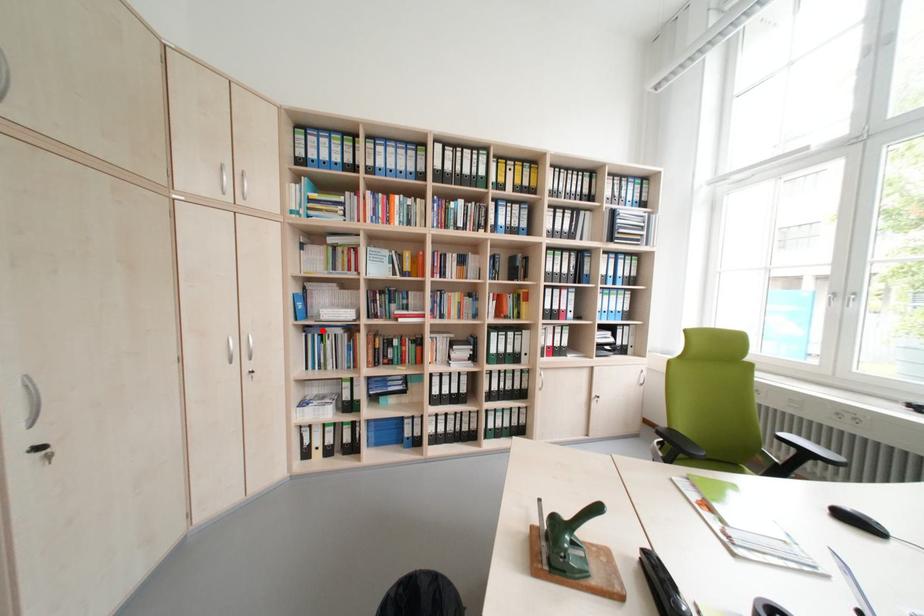
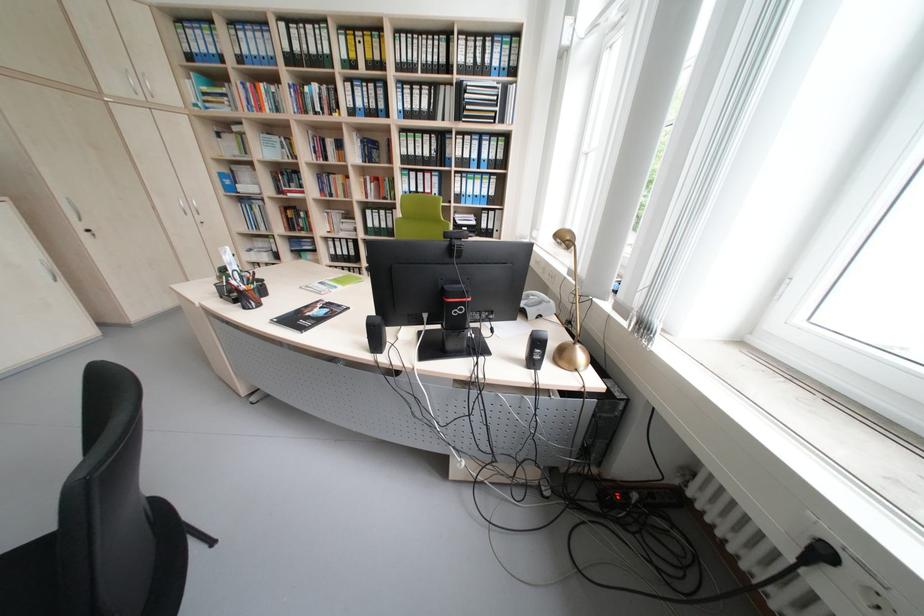
Question: I am providing you with two images of the same scene from different viewpoints. In image1, a red point is highlighted. Considering the same 3D point in image2, which of the following is correct?

Choices:
 (A) It is closer
 (B) It is farther

Answer: (A)